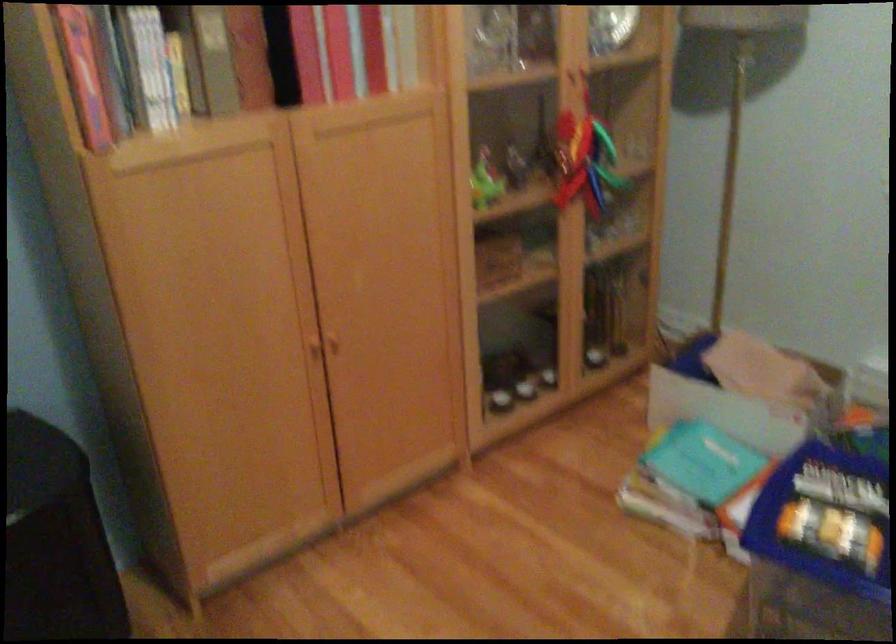
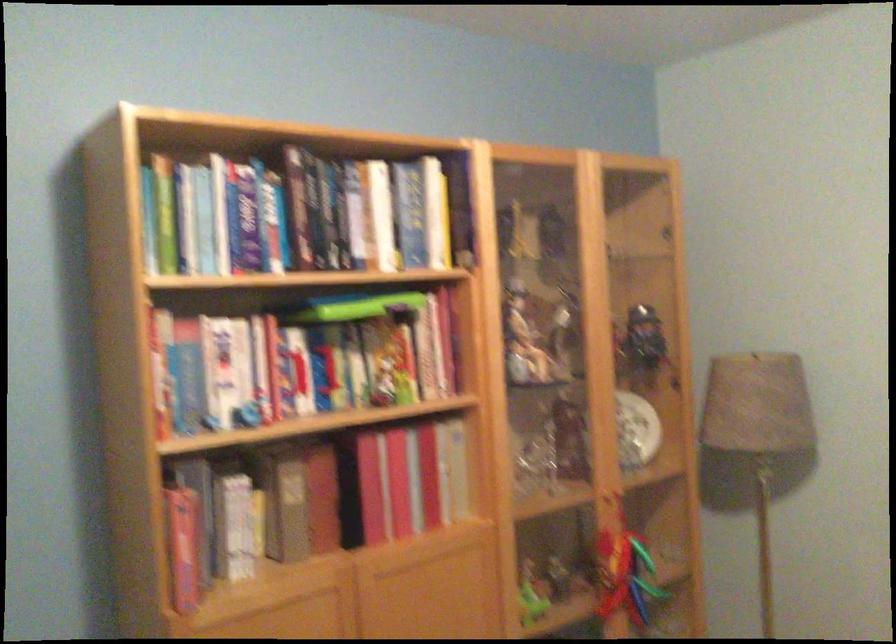
In the second image, find the point that corresponds to point 574,79 in the first image.

(615, 497)